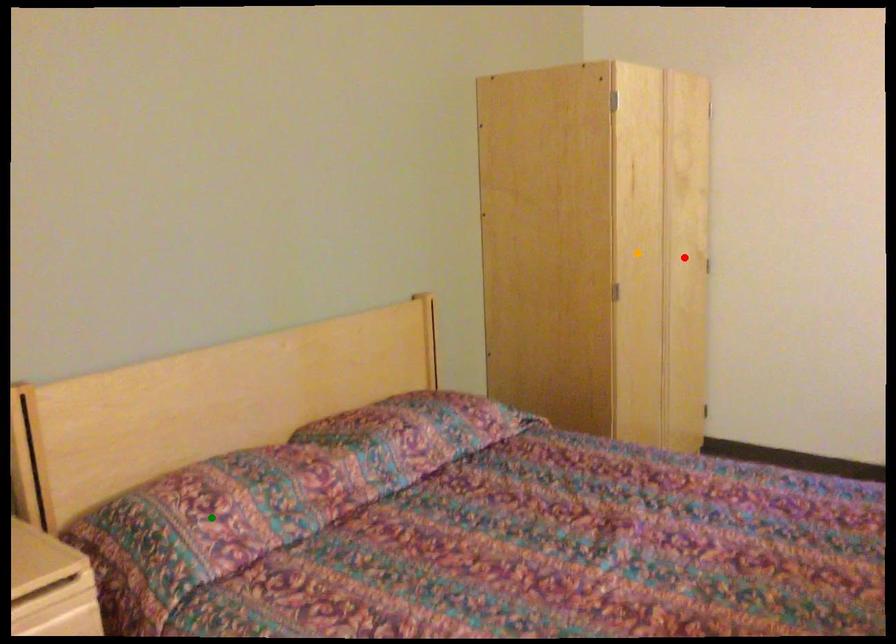
Order these from nearest to farthest:
green point | orange point | red point

red point
orange point
green point